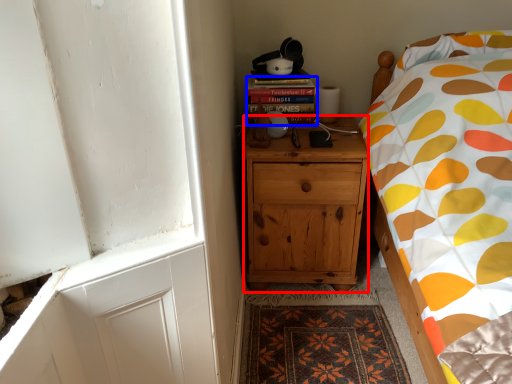
Question: Which point is further to the camera, cabinetry (highlighted by a red box) or book (highlighted by a blue box)?

Choices:
 (A) cabinetry
 (B) book

Answer: (B)